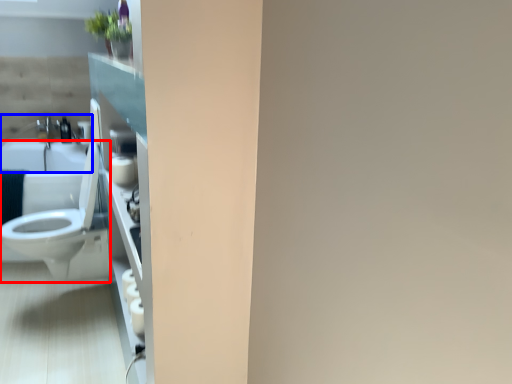
Question: Which of the following is the closest to the observer, toilet (highlighted by a red box) or sink (highlighted by a blue box)?

Choices:
 (A) toilet
 (B) sink

Answer: (A)